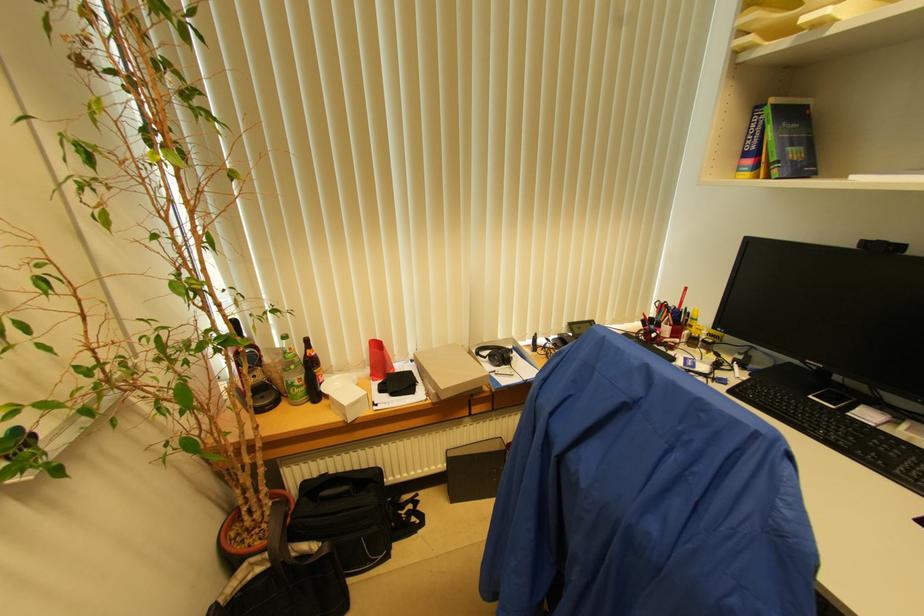
Where would you adjust the black webcam? Please return your answer as a coordinate pair (x, y).

(881, 246)